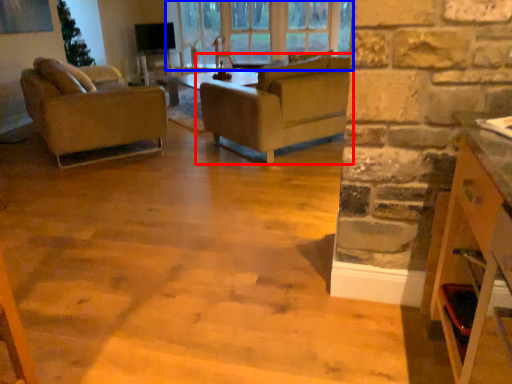
Question: Which of the following is the closest to the observer, studio couch (highlighted by a red box) or window (highlighted by a blue box)?

Choices:
 (A) studio couch
 (B) window

Answer: (A)